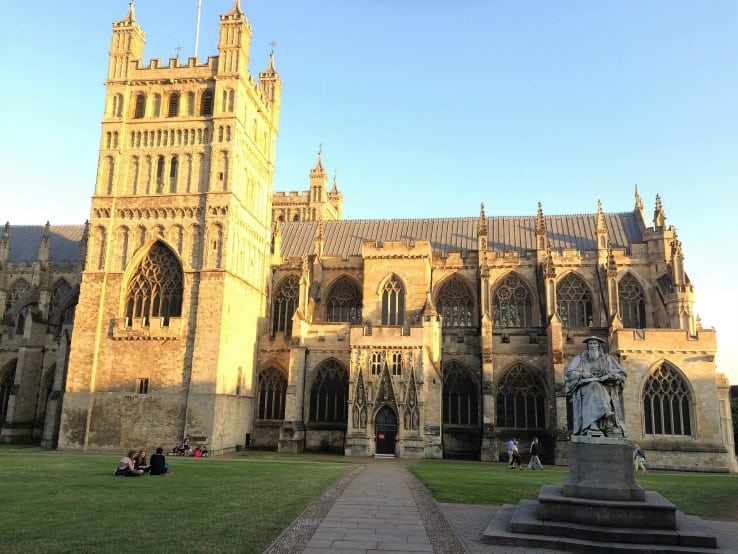
Locate an element on the screen. The image size is (738, 554). window is located at coordinates (452, 305), (519, 415), (154, 292).